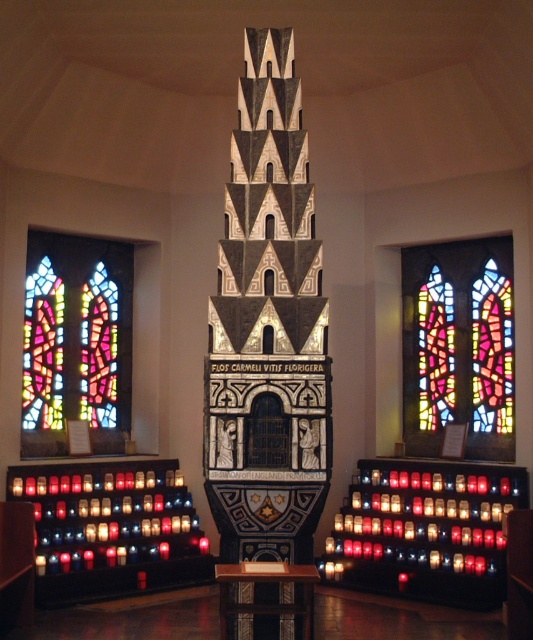
Which is in front, point (440, 400) or point (123, 272)?

Point (440, 400) is more forward.

Between stained glass window at center and stained glass window at left, which one has more height?

Standing taller between the two is stained glass window at left.

Based on the photo, who is more forward, (426, 308) or (102, 304)?

Point (426, 308) is in front.

Where is `stained glass window at center`? stained glass window at center is located at coordinates pyautogui.click(x=458, y=346).

Is black stone tower at center to the left of stained glass window at center from the viewer's perspective?

Yes, black stone tower at center is to the left of stained glass window at center.

Which is above, black stone tower at center or stained glass window at center?

black stone tower at center

Between point (308, 556) and point (448, 269), which one is positioned in front?

Point (308, 556)

This screenshot has width=533, height=640. Find the location of `black stone tower at center`. black stone tower at center is located at coordinates (268, 326).

Between black stone tower at center and stained glass window at left, which one appears on the left side from the viewer's perspective?

stained glass window at left is more to the left.

Which of these two, black stone tower at center or stained glass window at left, stands taller?

Standing taller between the two is black stone tower at center.

The width and height of the screenshot is (533, 640). I want to click on black stone tower at center, so click(268, 326).